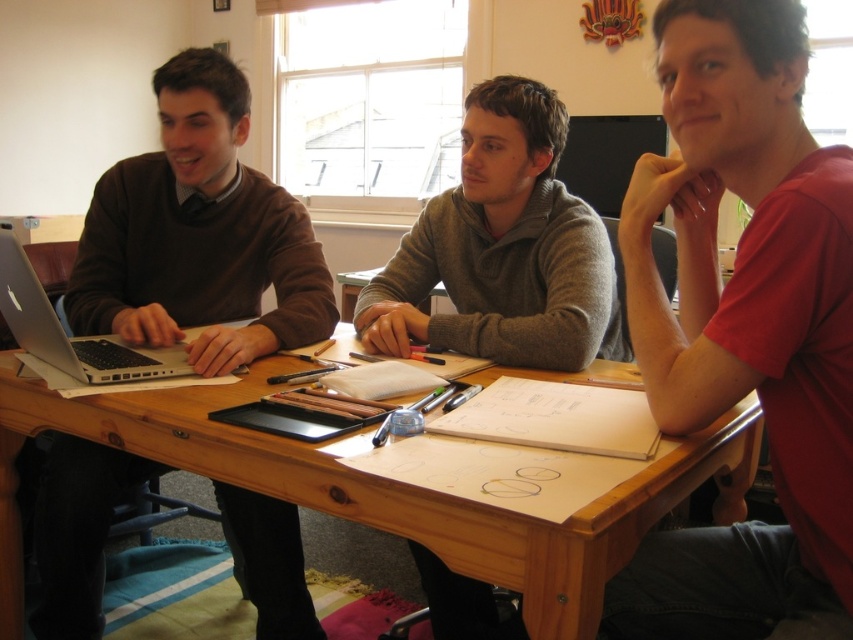
Question: Which point is closer to the camera taking this photo?

Choices:
 (A) (144, 156)
 (B) (12, 292)
 (C) (730, 499)

Answer: (B)

Question: Among these points, which one is farthest from the camera?

Choices:
 (A) (109, 380)
 (B) (183, 268)
 (C) (183, 448)

Answer: (B)

Question: Does red matte shirt at center appear on the right side of black matte monitor at center?

Choices:
 (A) yes
 (B) no

Answer: (B)

Question: Is red matte shirt at center above silver metallic laptop at left?

Choices:
 (A) yes
 (B) no

Answer: (B)

Question: Which object appears farthest from the camera in this image?

Choices:
 (A) matte brown sweater at left
 (B) silver metallic laptop at left
 (C) black matte monitor at center
 (D) wooden table at center

Answer: (C)

Question: Is red matte shirt at center behind matte brown sweater at left?

Choices:
 (A) yes
 (B) no

Answer: (B)